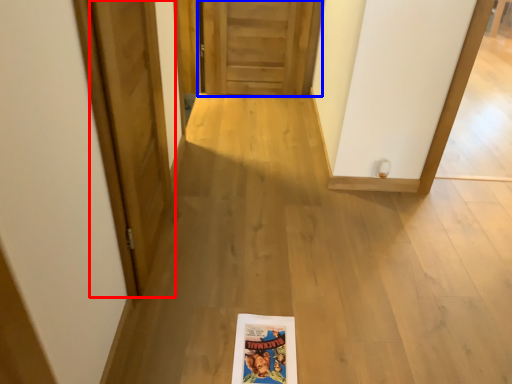
Question: Which of the following is the farthest to the observer, door (highlighted by a red box) or door (highlighted by a blue box)?

Choices:
 (A) door
 (B) door

Answer: (B)